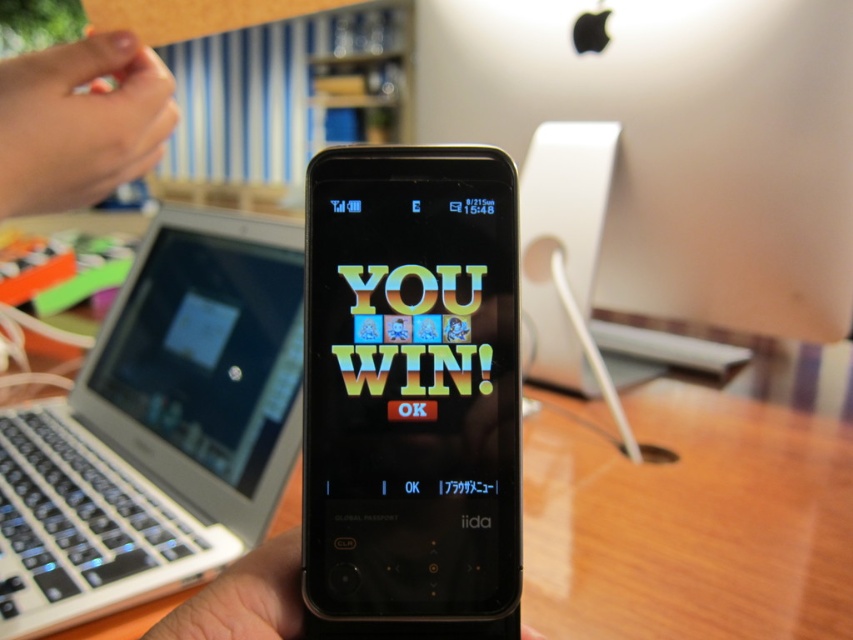
Is black glossy smartphone at center to the right of pink matte fingernail at upper left from the viewer's perspective?

Indeed, black glossy smartphone at center is positioned on the right side of pink matte fingernail at upper left.

Who is more distant from viewer, (451, 518) or (76, 145)?

Positioned behind is point (76, 145).

Find the location of a particular element. The height and width of the screenshot is (640, 853). black glossy smartphone at center is located at coordinates (410, 394).

Which is behind, point (166, 584) or point (263, 630)?

Positioned behind is point (166, 584).

Is white plastic laptop at left wider than black matte phone at center?

Indeed, white plastic laptop at left has a greater width compared to black matte phone at center.

Is point (288, 252) more distant than point (280, 554)?

Yes, it is.

Where is `white plastic laptop at left`? The height and width of the screenshot is (640, 853). white plastic laptop at left is located at coordinates (158, 428).

Does white plastic laptop at left lie in front of pink matte fingernail at upper left?

No, it is behind pink matte fingernail at upper left.

Is white plastic laptop at left shorter than pink matte fingernail at upper left?

In fact, white plastic laptop at left may be taller than pink matte fingernail at upper left.

Does point (223, 509) lie in front of point (131, 77)?

That is False.

Locate an element on the screen. white plastic laptop at left is located at coordinates (158, 428).